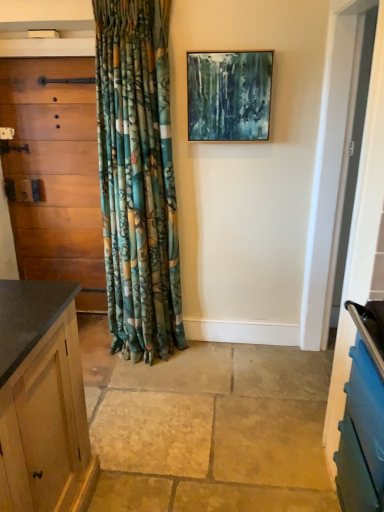
Question: From the image's perspective, is wooden cabinet at left on top of metallic gold picture frame at upper center?

Choices:
 (A) yes
 (B) no

Answer: (B)

Question: Are wooden cabinet at left and metallic gold picture frame at upper center beside each other?

Choices:
 (A) yes
 (B) no

Answer: (B)

Question: Is wooden cabinet at left outside of metallic gold picture frame at upper center?

Choices:
 (A) yes
 (B) no

Answer: (A)

Question: From a real-world perspective, is wooden cabinet at left located higher than metallic gold picture frame at upper center?

Choices:
 (A) no
 (B) yes

Answer: (A)

Question: Is the depth of wooden cabinet at left greater than that of metallic gold picture frame at upper center?

Choices:
 (A) no
 (B) yes

Answer: (B)

Question: Is metallic gold picture frame at upper center at the back of wooden cabinet at left?

Choices:
 (A) no
 (B) yes

Answer: (A)

Question: Is metallic gold picture frame at upper center oriented towards wooden cabinet at left?

Choices:
 (A) no
 (B) yes

Answer: (A)

Question: From the image's perspective, is metallic gold picture frame at upper center above wooden cabinet at left?

Choices:
 (A) no
 (B) yes

Answer: (B)

Question: From a real-world perspective, does metallic gold picture frame at upper center sit lower than wooden cabinet at left?

Choices:
 (A) yes
 (B) no

Answer: (B)

Question: Is metallic gold picture frame at upper center bigger than wooden cabinet at left?

Choices:
 (A) no
 (B) yes

Answer: (A)

Question: Considering the relative positions of metallic gold picture frame at upper center and wooden cabinet at left in the image provided, is metallic gold picture frame at upper center to the left of wooden cabinet at left from the viewer's perspective?

Choices:
 (A) yes
 (B) no

Answer: (B)

Question: From a real-world perspective, is metallic gold picture frame at upper center positioned over wooden cabinet at left based on gravity?

Choices:
 (A) no
 (B) yes

Answer: (B)

Question: Considering the positions of wooden cabinet at left and metallic gold picture frame at upper center in the image, is wooden cabinet at left wider or thinner than metallic gold picture frame at upper center?

Choices:
 (A) wide
 (B) thin

Answer: (A)